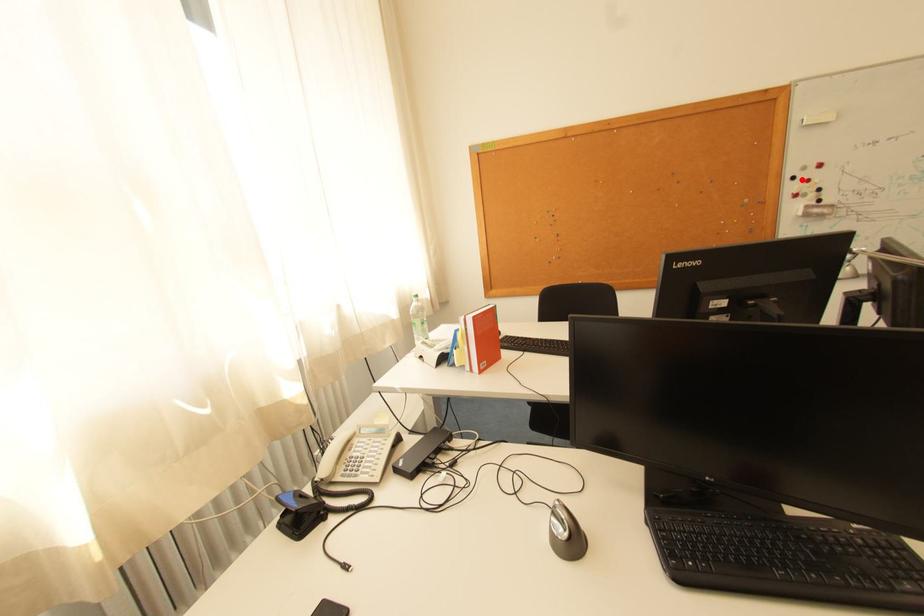
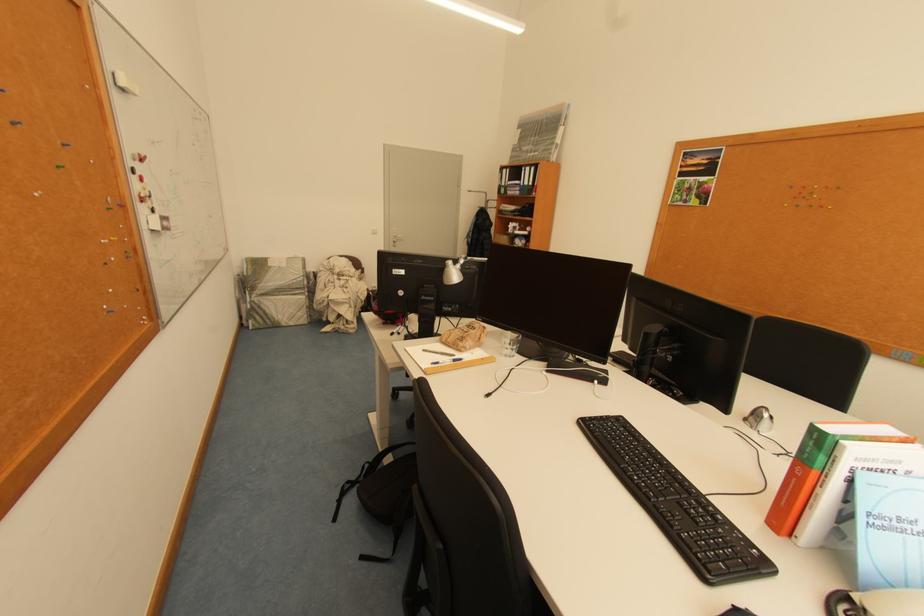
The point at the highlighted location is marked in the first image. Where is the corresponding point in the second image?

(141, 172)